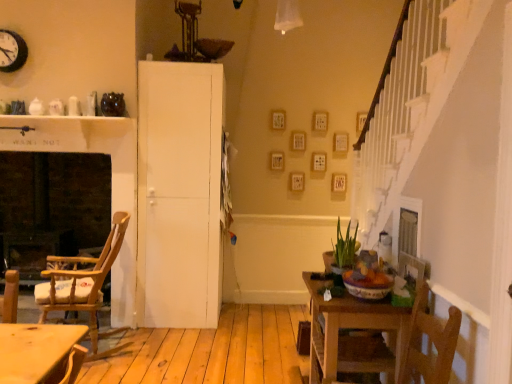
Question: Are white matte door at center and brick fireplace at left located far from each other?

Choices:
 (A) yes
 (B) no

Answer: (A)

Question: From the image's perspective, is white matte door at center beneath brick fireplace at left?

Choices:
 (A) yes
 (B) no

Answer: (B)

Question: Considering the relative sizes of white matte door at center and brick fireplace at left in the image provided, is white matte door at center thinner than brick fireplace at left?

Choices:
 (A) yes
 (B) no

Answer: (B)

Question: From a real-world perspective, is white matte door at center on top of brick fireplace at left?

Choices:
 (A) yes
 (B) no

Answer: (A)

Question: Is white matte door at center at the left side of brick fireplace at left?

Choices:
 (A) yes
 (B) no

Answer: (B)

Question: Is wooden table at lower right spatially inside white matte door at center, or outside of it?

Choices:
 (A) inside
 (B) outside

Answer: (B)

Question: From their relative heights in the image, would you say wooden table at lower right is taller or shorter than white matte door at center?

Choices:
 (A) tall
 (B) short

Answer: (B)

Question: Considering their positions, is wooden table at lower right located in front of or behind white matte door at center?

Choices:
 (A) front
 (B) behind

Answer: (A)

Question: Looking at the image, does wooden table at lower right seem bigger or smaller compared to white matte door at center?

Choices:
 (A) big
 (B) small

Answer: (B)

Question: From the image's perspective, relative to wooden table at lower right, is black metal clock at upper left above or below?

Choices:
 (A) above
 (B) below

Answer: (A)

Question: Considering the positions of black metal clock at upper left and wooden table at lower right in the image, is black metal clock at upper left taller or shorter than wooden table at lower right?

Choices:
 (A) short
 (B) tall

Answer: (A)

Question: Would you say black metal clock at upper left is to the left or to the right of wooden table at lower right in the picture?

Choices:
 (A) right
 (B) left

Answer: (B)

Question: In the image, is black metal clock at upper left positioned in front of or behind wooden table at lower right?

Choices:
 (A) behind
 (B) front

Answer: (A)

Question: Is wooden table at lower right situated inside wooden rocking chair at left or outside?

Choices:
 (A) outside
 (B) inside

Answer: (A)

Question: Considering the positions of point (402, 311) and point (120, 213), is point (402, 311) closer or farther from the camera than point (120, 213)?

Choices:
 (A) closer
 (B) farther

Answer: (A)